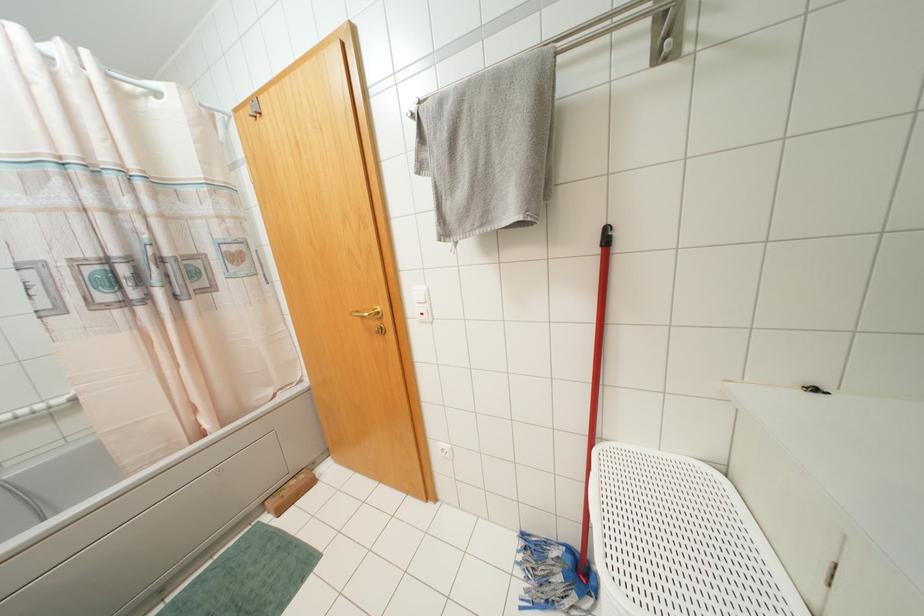
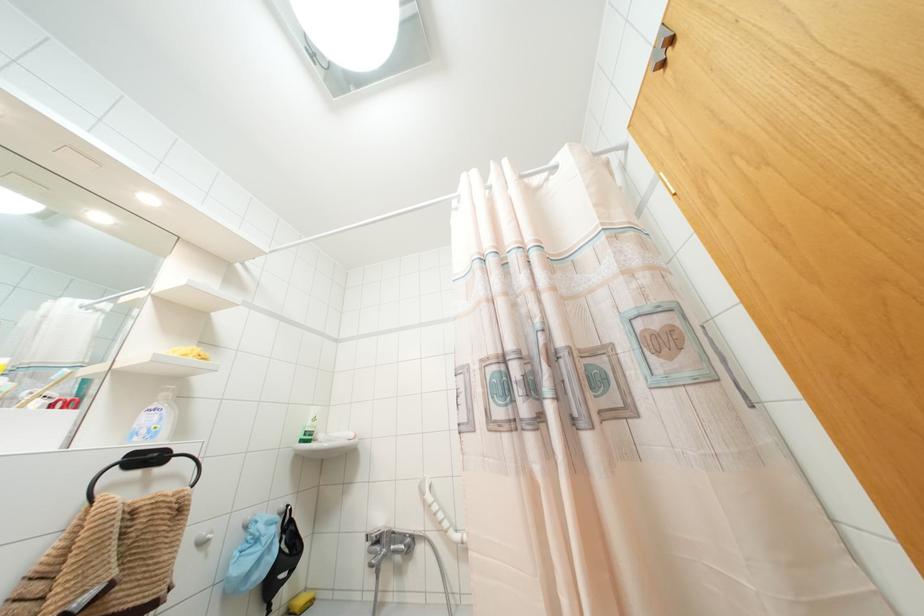
Based on the continuous images, in which direction is the camera rotating?

The rotation direction of the camera is left-up.